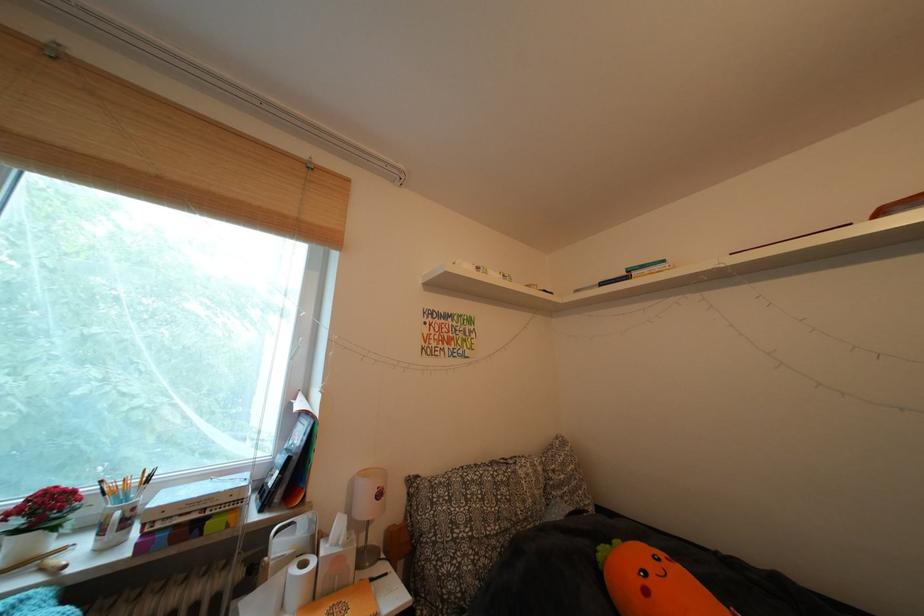
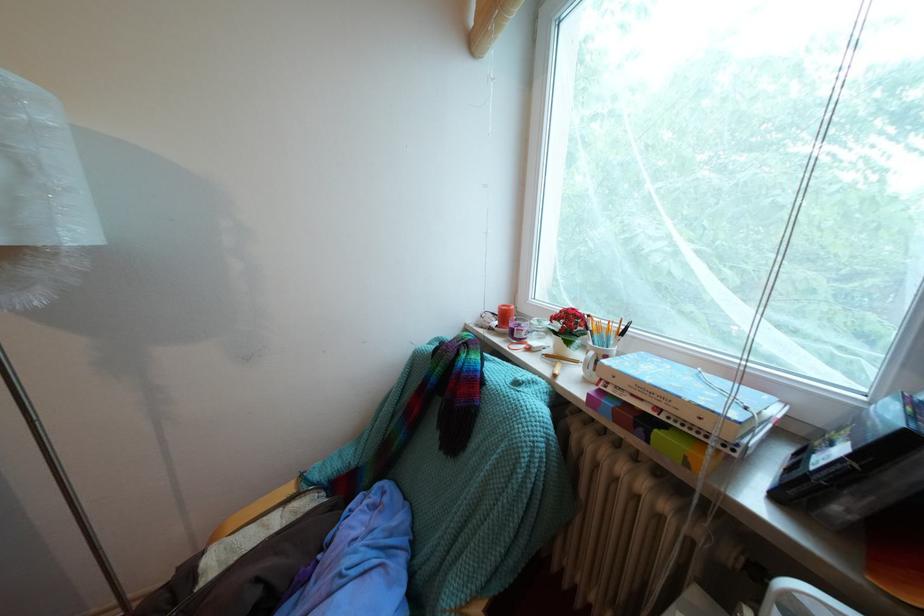
Where in the second image is the point corresponding to (214,515) from the first image?

(669, 415)